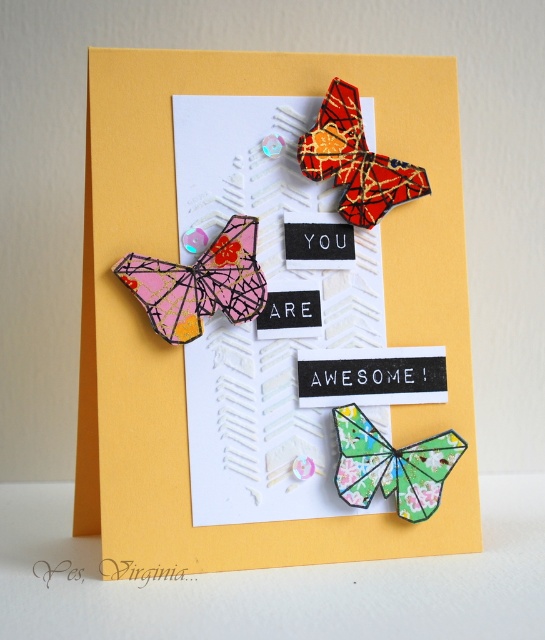
Question: Which object is farther from the camera taking this photo?

Choices:
 (A) green textured paper butterfly at center
 (B) matte pink paper butterfly at left

Answer: (A)

Question: Can you confirm if matte pink paper butterfly at left is thinner than metallic gold butterfly at upper center?

Choices:
 (A) yes
 (B) no

Answer: (B)

Question: Which object is positioned closest to the yellow paper card at upper center?

Choices:
 (A) matte pink paper butterfly at left
 (B) green textured paper butterfly at center
 (C) metallic gold butterfly at upper center

Answer: (A)

Question: Does matte pink paper butterfly at left have a greater width compared to green textured paper butterfly at center?

Choices:
 (A) no
 (B) yes

Answer: (B)

Question: Is yellow paper card at upper center positioned before metallic gold butterfly at upper center?

Choices:
 (A) yes
 (B) no

Answer: (A)

Question: Among these points, which one is farthest from the camera?

Choices:
 (A) (391, 80)
 (B) (253, 316)
 (C) (405, 172)

Answer: (A)